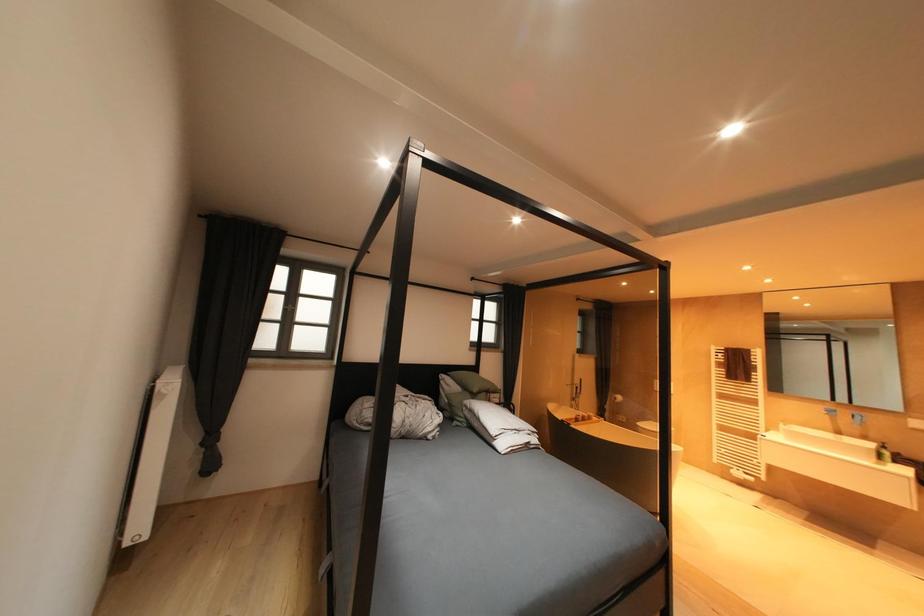
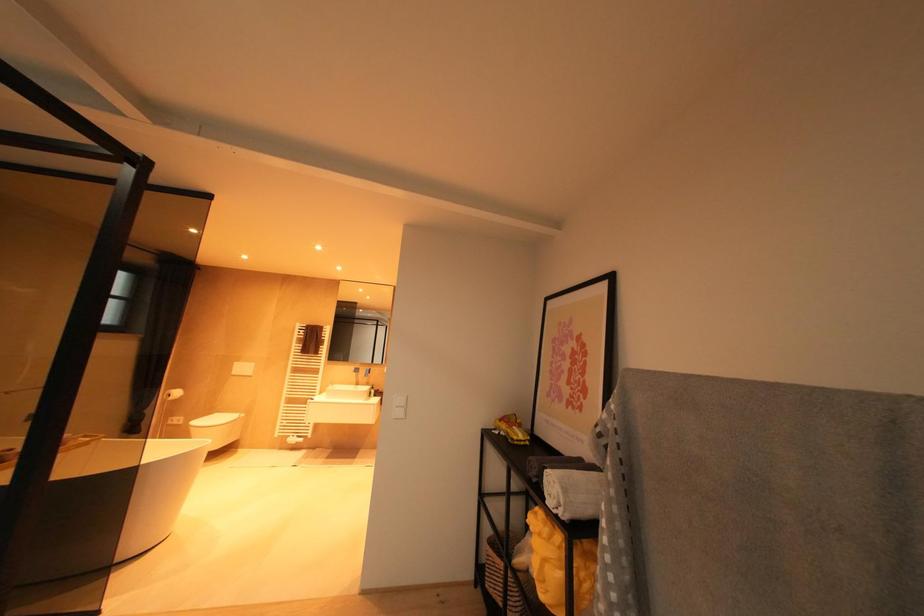
Question: The images are taken continuously from a first-person perspective. In which direction is your viewpoint rotating?

Choices:
 (A) Left
 (B) Right
 (C) Up
 (D) Down

Answer: (B)